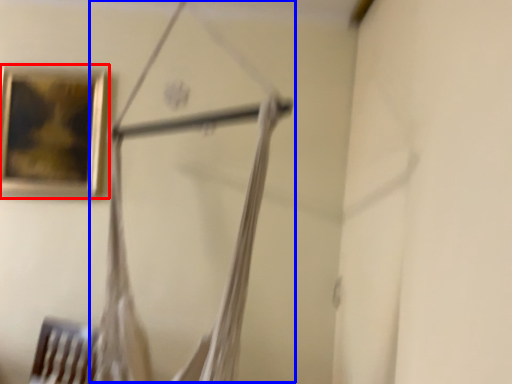
Question: Which object is closer to the camera taking this photo, picture frame (highlighted by a red box) or hanger (highlighted by a blue box)?

Choices:
 (A) picture frame
 (B) hanger

Answer: (B)